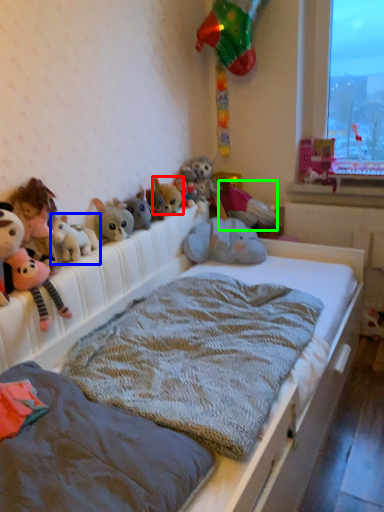
Question: Which is farther away from toy (highlighted by a red box)? toy (highlighted by a blue box) or toy (highlighted by a green box)?

Choices:
 (A) toy
 (B) toy

Answer: (A)